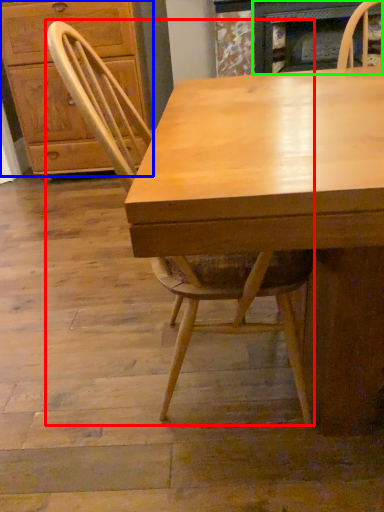
Question: Which is nearer to the chair (highlighted by a red box)? cabinetry (highlighted by a blue box) or fireplace (highlighted by a green box).

Choices:
 (A) cabinetry
 (B) fireplace

Answer: (A)